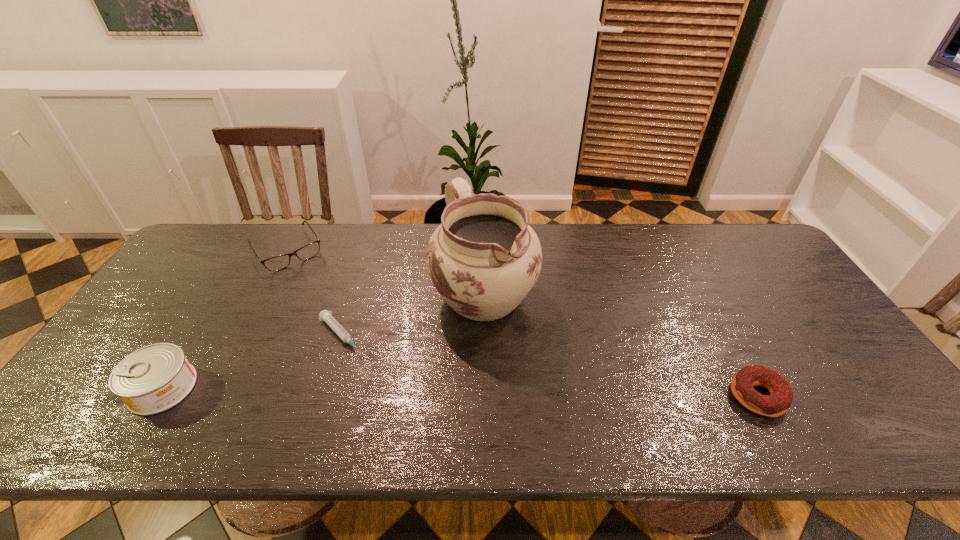
Identify which object is the fourth nearest to the spectacles. Please provide its 2D coordinates. Your answer should be formatted as a tuple, i.e. [(x, y)], where the tuple contains the x and y coordinates of a point satisfying the conditions above.

[(781, 395)]

The height and width of the screenshot is (540, 960). I want to click on object that can be found as the second closest to the shortest object, so click(279, 262).

This screenshot has height=540, width=960. I want to click on free space that satisfies the following two spatial constraints: 1. on the front side of the syringe; 2. on the right side of the rightmost object, so click(x=323, y=396).

Find the location of a particular element. The height and width of the screenshot is (540, 960). vacant area in the image that satisfies the following two spatial constraints: 1. on the front side of the second object from right to left; 2. on the right side of the doughnut is located at coordinates [x=485, y=396].